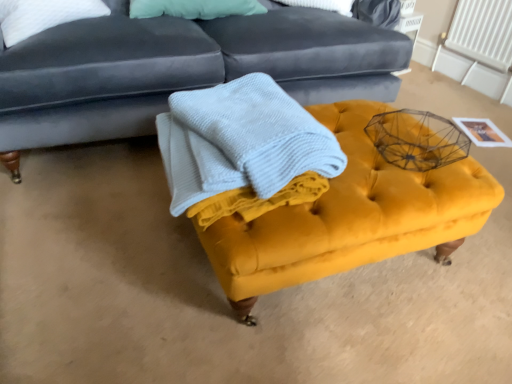
This screenshot has height=384, width=512. Describe the element at coordinates (182, 70) in the screenshot. I see `velvet dark blue studio couch at upper center` at that location.

Describe the element at coordinates (349, 217) in the screenshot. I see `velvet yellow ottoman at center` at that location.

Where is `velvet dark blue studio couch at upper center`? The width and height of the screenshot is (512, 384). velvet dark blue studio couch at upper center is located at coordinates (182, 70).

Is light blue textured blanket at center oriented towards velvet dark blue studio couch at upper center?

No, light blue textured blanket at center is not facing towards velvet dark blue studio couch at upper center.

From the image's perspective, which one is positioned higher, light blue textured blanket at center or velvet dark blue studio couch at upper center?

From the image's view, velvet dark blue studio couch at upper center is above.

Considering the relative sizes of light blue textured blanket at center and velvet dark blue studio couch at upper center in the image provided, is light blue textured blanket at center thinner than velvet dark blue studio couch at upper center?

Correct, the width of light blue textured blanket at center is less than that of velvet dark blue studio couch at upper center.

Considering the relative positions of white plastic radiator at upper right and velvet yellow ottoman at center in the image provided, is white plastic radiator at upper right to the left of velvet yellow ottoman at center from the viewer's perspective?

No.

From a real-world perspective, is white plastic radiator at upper right on velvet yellow ottoman at center?

Yes.

Which point is more forward, (x=489, y=33) or (x=490, y=188)?

The point (x=490, y=188) is in front.

From a real-world perspective, is light blue textured blanket at center located higher than velvet yellow ottoman at center?

Correct, in the physical world, light blue textured blanket at center is higher than velvet yellow ottoman at center.

Is the surface of light blue textured blanket at center in direct contact with velvet yellow ottoman at center?

light blue textured blanket at center and velvet yellow ottoman at center are not in contact.

Consider the image. Which object is thinner, light blue textured blanket at center or velvet yellow ottoman at center?

With smaller width is light blue textured blanket at center.

Which object is closer to the camera taking this photo, light blue textured blanket at center or velvet yellow ottoman at center?

Positioned in front is light blue textured blanket at center.

From a real-world perspective, is velvet yellow ottoman at center positioned above or below velvet dark blue studio couch at upper center?

velvet yellow ottoman at center is below velvet dark blue studio couch at upper center.

Does velvet yellow ottoman at center have a lesser height compared to velvet dark blue studio couch at upper center?

Correct, velvet yellow ottoman at center is not as tall as velvet dark blue studio couch at upper center.

Based on the photo, which is farther, (409,177) or (113,81)?

The point (113,81) is farther from the camera.

Is velvet dark blue studio couch at upper center surrounded by velvet yellow ottoman at center?

No.

Does point (397, 89) come farther from viewer compared to point (388, 186)?

Yes, it is.

From a real-world perspective, who is located lower, velvet dark blue studio couch at upper center or velvet yellow ottoman at center?

From a 3D spatial view, velvet yellow ottoman at center is below.

Image resolution: width=512 pixels, height=384 pixels. There is a velvet yellow ottoman at center. In order to click on studio couch above it (from a real-world perspective) in this screenshot , I will do `click(182, 70)`.

Is velvet dark blue studio couch at upper center outside of velvet yellow ottoman at center?

Yes.

Find the location of a particular element. This screenshot has height=384, width=512. blanket above the velvet yellow ottoman at center (from the image's perspective) is located at coordinates (241, 141).

Is velvet yellow ottoman at center located outside light blue textured blanket at center?

Yes, velvet yellow ottoman at center is not within light blue textured blanket at center.

What's the angular difference between velvet yellow ottoman at center and light blue textured blanket at center's facing directions?

The angular difference between velvet yellow ottoman at center and light blue textured blanket at center is 1.46 degrees.

Based on the photo, between velvet yellow ottoman at center and light blue textured blanket at center, which one appears on the left side from the viewer's perspective?

Positioned to the left is light blue textured blanket at center.

Does point (305, 267) appear closer or farther from the camera than point (497, 52)?

Point (305, 267).

How distant is velvet yellow ottoman at center from white plastic radiator at upper right?

1.65 meters.

From a real-world perspective, is velvet yellow ottoman at center positioned above or below white plastic radiator at upper right?

velvet yellow ottoman at center is below white plastic radiator at upper right.

Considering the sizes of objects velvet yellow ottoman at center and white plastic radiator at upper right in the image provided, who is thinner, velvet yellow ottoman at center or white plastic radiator at upper right?

With smaller width is white plastic radiator at upper right.

At what (x,y) coordinates should I click in order to perform the action: click on blanket above the velvet dark blue studio couch at upper center (from a real-world perspective). Please return your answer as a coordinate pair (x, y). Looking at the image, I should click on (241, 141).

Identify the location of radiator located behind the velvet yellow ottoman at center. (482, 32).

Estimate the real-world distances between objects in this image. Which object is further from white plastic radiator at upper right, velvet yellow ottoman at center or light blue textured blanket at center?

light blue textured blanket at center is positioned further to the anchor white plastic radiator at upper right.

Looking at the image, which one is located further to light blue textured blanket at center, velvet yellow ottoman at center or velvet dark blue studio couch at upper center?

velvet dark blue studio couch at upper center is positioned further to the anchor light blue textured blanket at center.

Which object lies nearer to the anchor point velvet dark blue studio couch at upper center, velvet yellow ottoman at center or white plastic radiator at upper right?

Based on the image, velvet yellow ottoman at center appears to be nearer to velvet dark blue studio couch at upper center.

From the image, which object appears to be farther from velvet dark blue studio couch at upper center, light blue textured blanket at center or velvet yellow ottoman at center?

Among the two, velvet yellow ottoman at center is located further to velvet dark blue studio couch at upper center.

Based on the photo, looking at the image, which one is located closer to light blue textured blanket at center, white plastic radiator at upper right or velvet yellow ottoman at center?

velvet yellow ottoman at center is positioned closer to the anchor light blue textured blanket at center.

Looking at the image, which one is located closer to light blue textured blanket at center, white plastic radiator at upper right or velvet dark blue studio couch at upper center?

velvet dark blue studio couch at upper center.

Estimate the real-world distances between objects in this image. Which object is closer to velvet dark blue studio couch at upper center, light blue textured blanket at center or white plastic radiator at upper right?

light blue textured blanket at center is positioned closer to the anchor velvet dark blue studio couch at upper center.

Looking at the image, which one is located further to velvet yellow ottoman at center, light blue textured blanket at center or white plastic radiator at upper right?

white plastic radiator at upper right lies further to velvet yellow ottoman at center than the other object.

This screenshot has width=512, height=384. Identify the location of swivel chair between light blue textured blanket at center and white plastic radiator at upper right along the z-axis. (349, 217).

Where is `swivel chair between velvet dark blue studio couch at upper center and white plastic radiator at upper right`? The height and width of the screenshot is (384, 512). swivel chair between velvet dark blue studio couch at upper center and white plastic radiator at upper right is located at coordinates (349, 217).

This screenshot has width=512, height=384. In order to click on blanket between velvet dark blue studio couch at upper center and white plastic radiator at upper right from left to right in this screenshot , I will do `click(241, 141)`.

Where is `blanket between velvet dark blue studio couch at upper center and velvet yellow ottoman at center in the up-down direction`? The height and width of the screenshot is (384, 512). blanket between velvet dark blue studio couch at upper center and velvet yellow ottoman at center in the up-down direction is located at coordinates (241, 141).